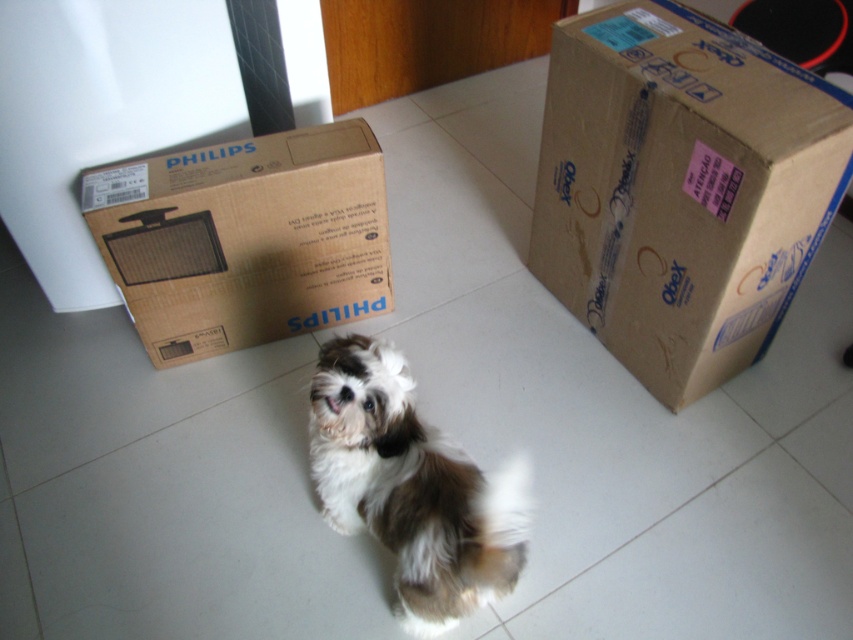
You are standing in a room with a fluffy white dog at center and a brown cardboard box at upper left. If you want to move the brown cardboard box to the right side of the dog, which direction should you move the box relative to your current position?

You should move the brown cardboard box at upper left to the right side of the fluffy white dog at center, which means moving it towards the right from its current position since it is currently to the left of the dog.

You are trying to decide whether the fluffy white dog at center can fit through the space between the brown cardboard box at upper left and the wall. Based on their sizes, can the dog pass through?

The brown cardboard box at upper left is larger in size than the fluffy white dog at center, so there might be enough space for the dog to pass through the gap between the box and the wall.